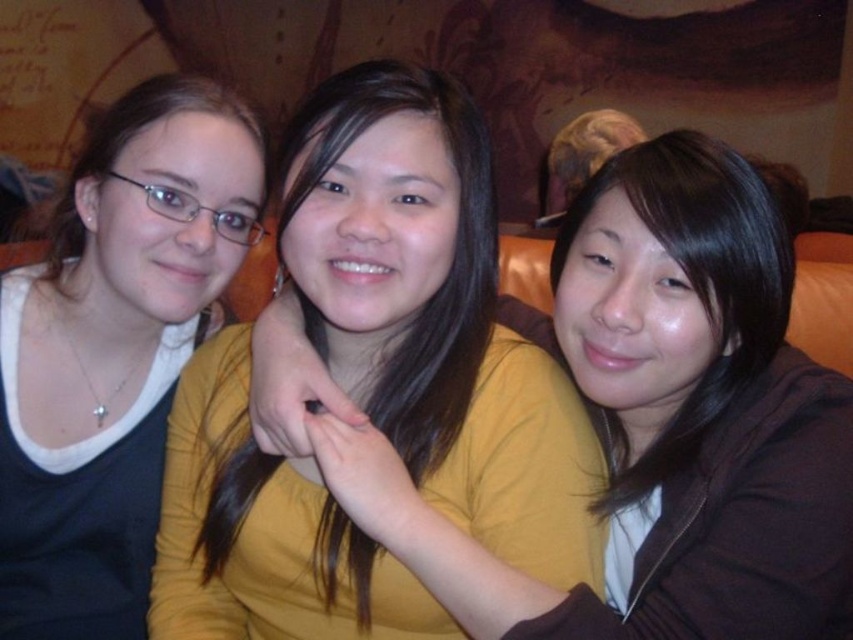
Does yellow matte shirt at center appear over matte black shirt at left?

Incorrect, yellow matte shirt at center is not positioned above matte black shirt at left.

Which is more to the left, yellow matte shirt at center or matte black shirt at left?

Positioned to the left is matte black shirt at left.

Does point (466, 289) come closer to viewer compared to point (32, 337)?

Yes, it is in front of point (32, 337).

Find the location of `yellow matte shirt at center`. yellow matte shirt at center is located at coordinates (434, 314).